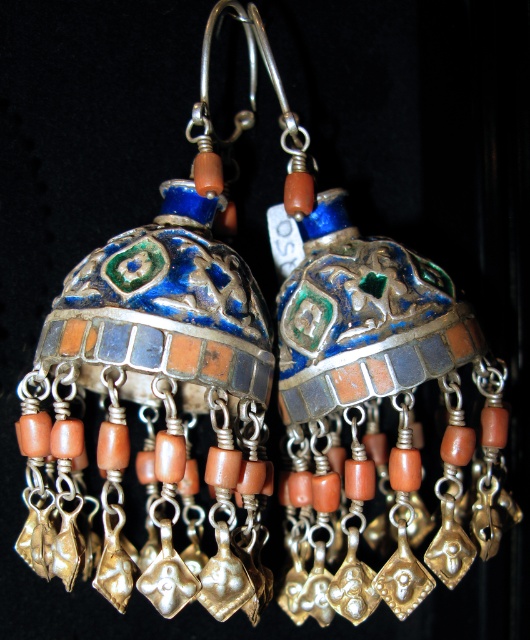
Is point (220, 314) positioned behind point (398, 68)?

No, it is in front of (398, 68).

Between enamel/metallic earrings at center and enamel/metallic dome at center, which one is positioned higher?

enamel/metallic earrings at center is higher up.

Does point (110, 372) come behind point (480, 195)?

No, (110, 372) is in front of (480, 195).

This screenshot has width=530, height=640. What are the coordinates of `enamel/metallic earrings at center` in the screenshot? It's located at (152, 390).